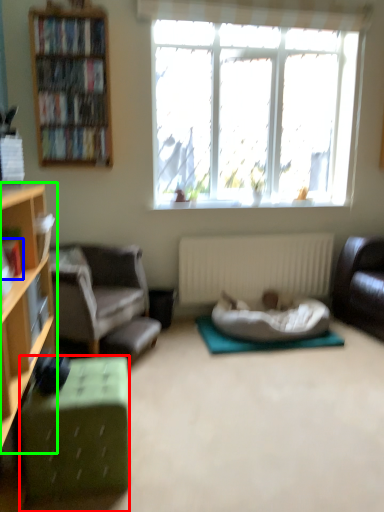
Question: Considering the real-world distances, which object is farthest from desk (highlighted by a red box)? book (highlighted by a blue box) or cabinetry (highlighted by a green box)?

Choices:
 (A) book
 (B) cabinetry

Answer: (A)